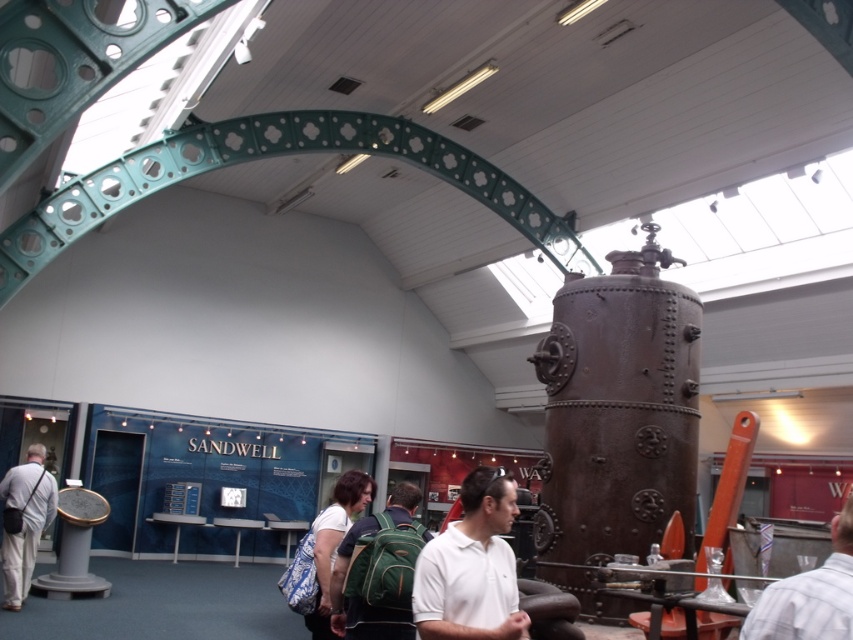
You are a photographer who needs to take a photo of the striped shirt at center. You are standing 10 feet away from the camera. Can you reach the camera to take the photo?

The striped shirt at center and camera are 8.97 feet apart from each other. Since you are 10 feet away from the camera, you are slightly farther than the distance between the shirt and the camera. Therefore, you can still reach the camera to take the photo as the distance is manageable.